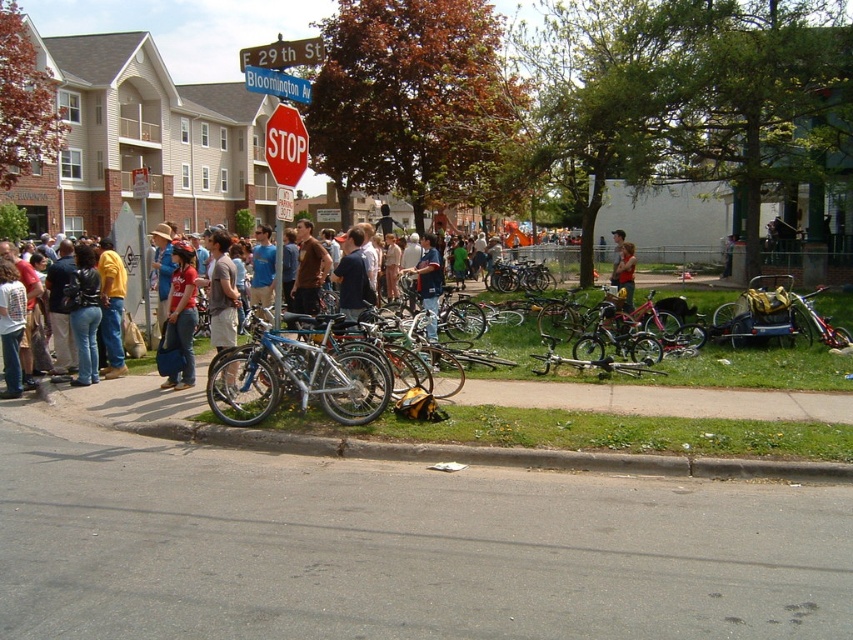
You are standing at the intersection of 29th Street and Bloomington Avenue and see two points marked on the ground. The first point is at coordinates point (276, 109) and the second point is at point (312, 51). Which point is closer to you?

Point (312, 51) is closer to you because it is not as far as point (276, 109) which is further away.

You are standing at point (305, 348) and want to walk to point (422, 460). Is the destination point in front of or behind your current position?

Point (422, 460) is in front of point (305, 348), so the destination is in front of your current position.

You are a delivery person standing at the intersection of 29th Street and Bloomington Avenue. You need to deliver a package to the apartment building. There is a point at coordinates point (x=285, y=145). Where is this point located?

The point (x=285, y=145) is on the red matte stop sign at center.